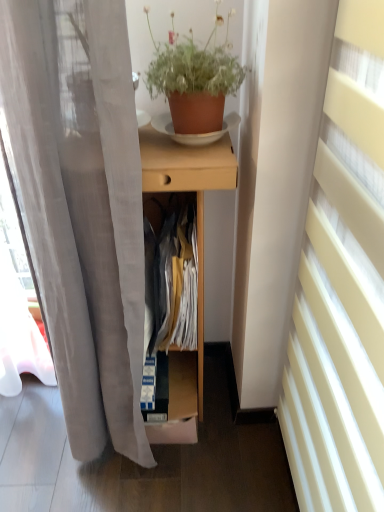
Question: Is terracotta clay pot at upper center placed right next to white sheer curtain at right?

Choices:
 (A) yes
 (B) no

Answer: (B)

Question: Does terracotta clay pot at upper center have a lesser width compared to white sheer curtain at right?

Choices:
 (A) no
 (B) yes

Answer: (A)

Question: Can you confirm if terracotta clay pot at upper center is bigger than white sheer curtain at right?

Choices:
 (A) yes
 (B) no

Answer: (B)

Question: From a real-world perspective, is terracotta clay pot at upper center on white sheer curtain at right?

Choices:
 (A) yes
 (B) no

Answer: (A)

Question: Is terracotta clay pot at upper center oriented away from white sheer curtain at right?

Choices:
 (A) no
 (B) yes

Answer: (A)

Question: Does point (317, 424) appear closer or farther from the camera than point (153, 131)?

Choices:
 (A) farther
 (B) closer

Answer: (B)

Question: Relative to light wood desk at center, is white sheer curtain at right in front or behind?

Choices:
 (A) behind
 (B) front

Answer: (B)

Question: Is white sheer curtain at right taller or shorter than light wood desk at center?

Choices:
 (A) tall
 (B) short

Answer: (A)

Question: From the image's perspective, is white sheer curtain at right above or below light wood desk at center?

Choices:
 (A) below
 (B) above

Answer: (A)

Question: Visually, is terracotta clay pot at upper center positioned to the left or to the right of cardboard box at center?

Choices:
 (A) left
 (B) right

Answer: (B)

Question: From the image's perspective, is terracotta clay pot at upper center positioned above or below cardboard box at center?

Choices:
 (A) below
 (B) above

Answer: (B)

Question: Considering the positions of terracotta clay pot at upper center and cardboard box at center in the image, is terracotta clay pot at upper center taller or shorter than cardboard box at center?

Choices:
 (A) short
 (B) tall

Answer: (B)

Question: Looking at their shapes, would you say terracotta clay pot at upper center is wider or thinner than cardboard box at center?

Choices:
 (A) wide
 (B) thin

Answer: (B)

Question: Is white sheer curtain at right wider or thinner than cardboard box at center?

Choices:
 (A) thin
 (B) wide

Answer: (A)

Question: From their relative heights in the image, would you say white sheer curtain at right is taller or shorter than cardboard box at center?

Choices:
 (A) short
 (B) tall

Answer: (B)